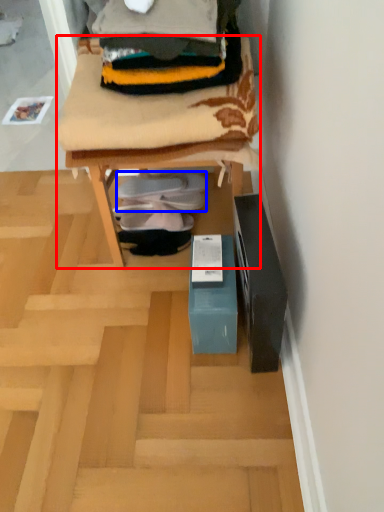
Question: Which point is closer to the camera, furniture (highlighted by a red box) or footwear (highlighted by a blue box)?

Choices:
 (A) furniture
 (B) footwear

Answer: (A)